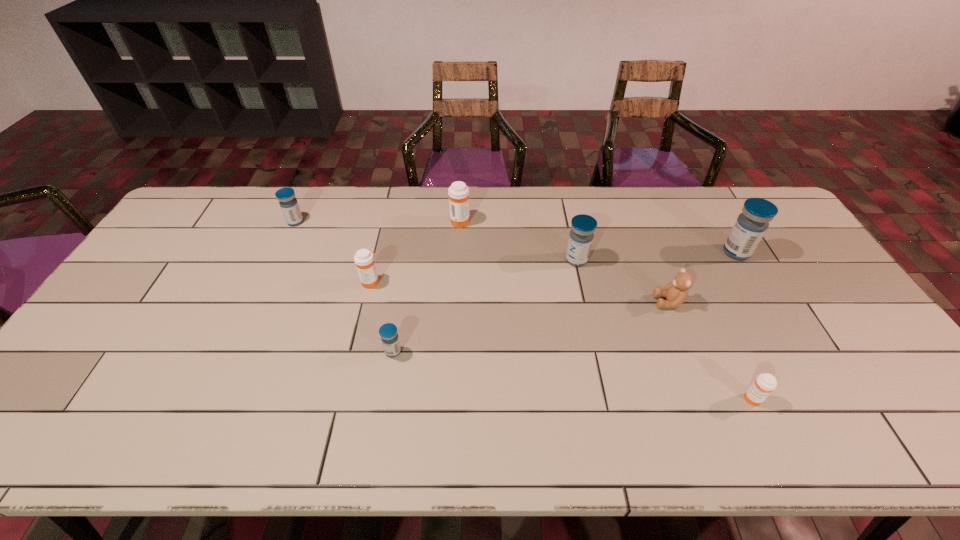
The width and height of the screenshot is (960, 540). Find the location of `free location that satisfies the following two spatial constraints: 1. on the front side of the biggest orange medicine; 2. on the left side of the third medicine from right to left`. free location that satisfies the following two spatial constraints: 1. on the front side of the biggest orange medicine; 2. on the left side of the third medicine from right to left is located at coordinates (458, 260).

I want to click on free location that satisfies the following two spatial constraints: 1. on the front side of the leftmost blue medicine; 2. on the left side of the sixth medicine from right to left, so click(268, 282).